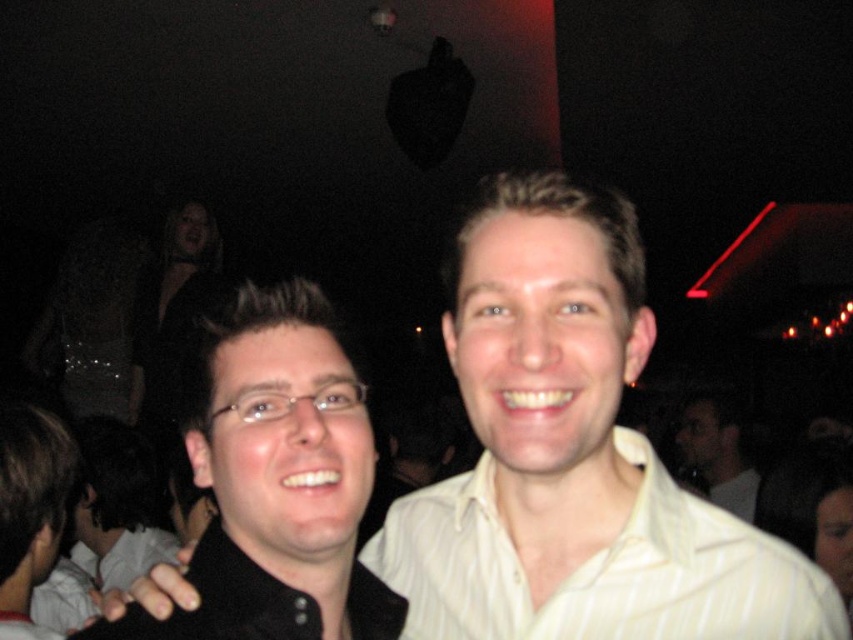
Question: Does white striped dress shirt at center appear under light beige shirt at center?

Choices:
 (A) no
 (B) yes

Answer: (A)

Question: Which point is closer to the camera taking this photo?

Choices:
 (A) (57, 477)
 (B) (704, 452)

Answer: (A)

Question: Which of these objects is positioned farthest from the white striped dress shirt at center?

Choices:
 (A) black glossy hair at left
 (B) light beige shirt at center
 (C) matte black shirt at center

Answer: (B)

Question: Is matte black shirt at center positioned at the back of black glossy hair at left?

Choices:
 (A) yes
 (B) no

Answer: (B)

Question: Which object is the farthest from the white striped dress shirt at center?

Choices:
 (A) light beige shirt at center
 (B) matte black shirt at center
 (C) black glossy hair at left

Answer: (A)

Question: Is white striped dress shirt at center behind light beige shirt at center?

Choices:
 (A) no
 (B) yes

Answer: (A)